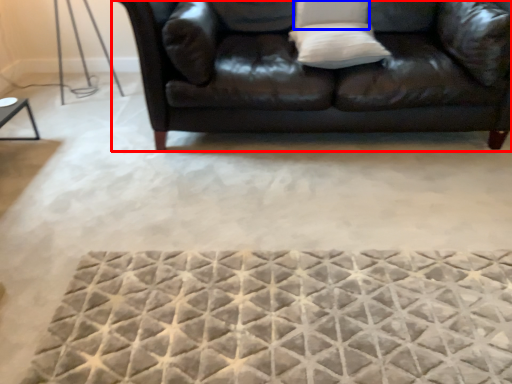
Question: Which object is closer to the camera taking this photo, studio couch (highlighted by a red box) or pillow (highlighted by a blue box)?

Choices:
 (A) studio couch
 (B) pillow

Answer: (A)